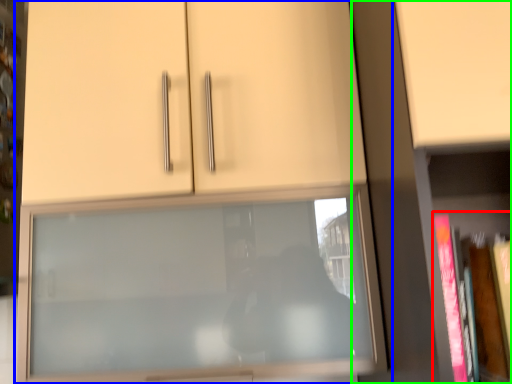
Question: Based on their relative distances, which object is nearer to book (highlighted by a red box)? Choose from cupboard (highlighted by a blue box) and bookcase (highlighted by a green box).

Choices:
 (A) cupboard
 (B) bookcase

Answer: (B)